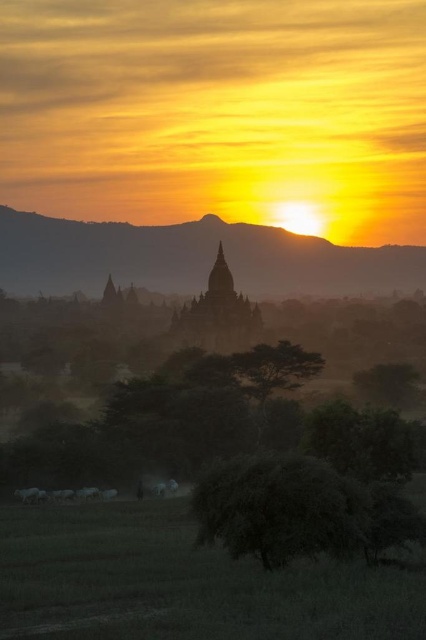
From the picture: Between dark gray stone temple at center and green leafy tree at center, which one appears on the left side from the viewer's perspective?

dark gray stone temple at center

Is point (232, 291) behind point (288, 342)?

Yes.

I want to click on dark gray stone temple at center, so click(x=218, y=312).

How much distance is there between green grassy field at lower center and green leafy tree at center?

green grassy field at lower center is 236.32 feet from green leafy tree at center.

Is point (92, 538) closer to viewer compared to point (252, 378)?

Yes, it is.

This screenshot has height=640, width=426. I want to click on green grassy field at lower center, so click(183, 582).

Is green grassy field at lower center below dark gray stone temple at center?

Indeed, green grassy field at lower center is positioned under dark gray stone temple at center.

Is the position of green grassy field at lower center more distant than that of dark gray stone temple at center?

No, it is not.

Measure the distance between green grassy field at lower center and camera.

A distance of 49.50 meters exists between green grassy field at lower center and camera.

Find the location of a particular element. green grassy field at lower center is located at coordinates (183, 582).